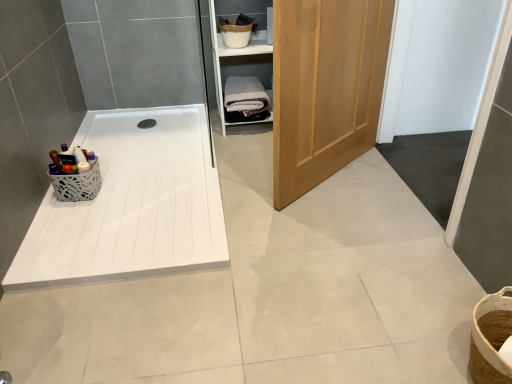
Identify the location of vacant area that is in front of white lace basket at left. (65, 208).